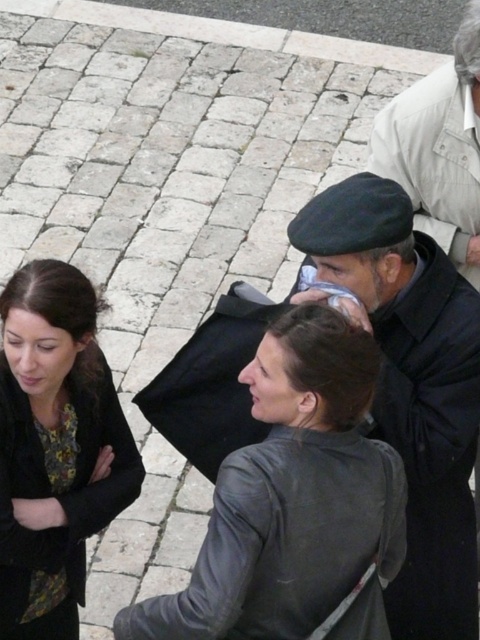
You are standing at the camera position and want to throw a small ball to hit the point at coordinates (247, 456). Is the distance within your throwing range of 3 meters?

The point at (247, 456) is 2.55 meters away from the camera, so yes, the distance is within your 3 meters throwing range.

You are standing on the balcony and want to find the dark gray woolen coat at center. Based on the coordinates provided, in which direction should you look relative to the center of the image?

The dark gray woolen coat at center is located at point (411,387), which means it is slightly to the right and above the center of the image. You should look towards the upper right direction from the center to find it.